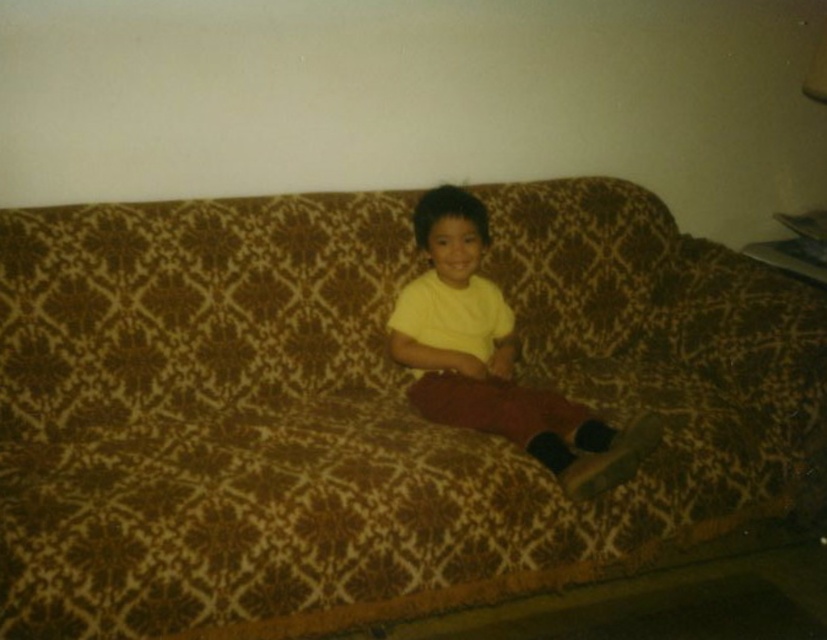
Can you confirm if brown textured couch at center is positioned above yellow matte shirt at center?

Actually, brown textured couch at center is below yellow matte shirt at center.

Does brown textured couch at center have a lesser width compared to yellow matte shirt at center?

No, brown textured couch at center is not thinner than yellow matte shirt at center.

Describe the element at coordinates (362, 408) in the screenshot. I see `brown textured couch at center` at that location.

Locate an element on the screen. The image size is (827, 640). brown textured couch at center is located at coordinates (362, 408).